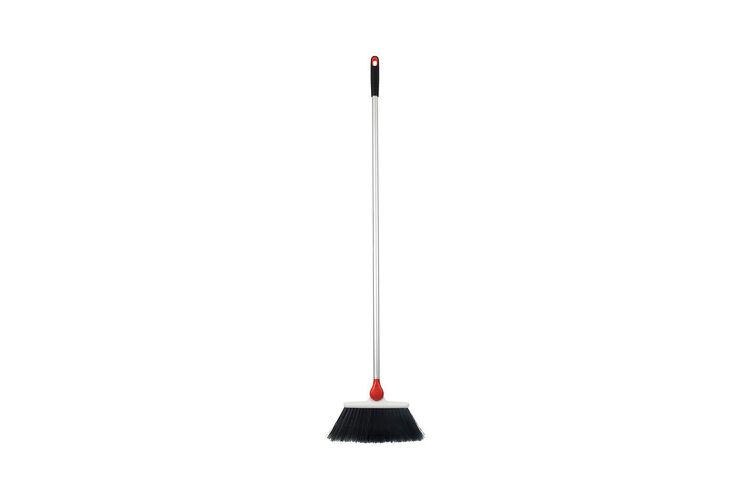
You are a GUI agent. You are given a task and a screenshot of the screen. Output one action in this format:
    pyautogui.click(x=<x>, y=<y>)
    Task: Click on the broom handle black
    The height and width of the screenshot is (500, 750).
    Given the screenshot: What is the action you would take?
    pyautogui.click(x=373, y=58), pyautogui.click(x=375, y=77)